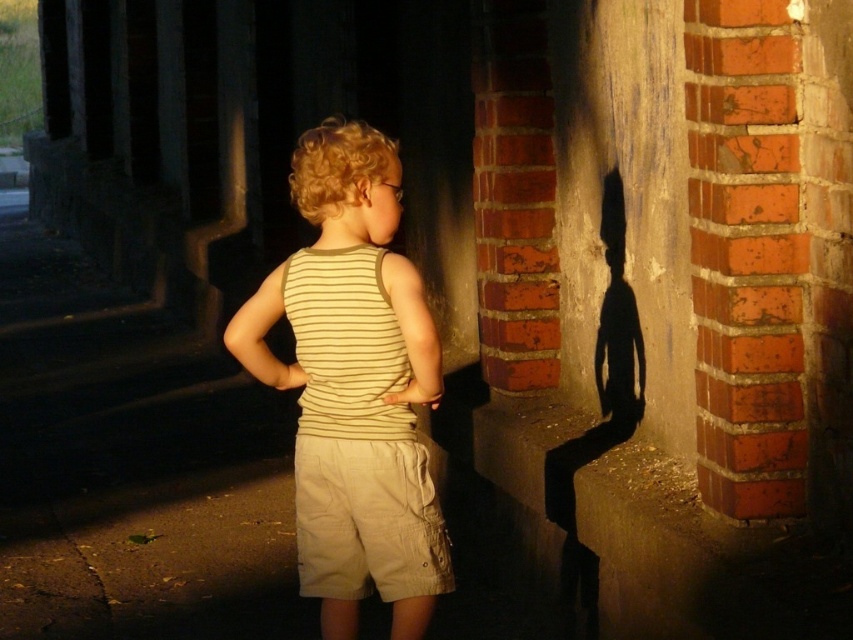
Who is taller, striped cotton tank top at center or khaki cotton shorts at center?

striped cotton tank top at center is taller.

This screenshot has height=640, width=853. Describe the element at coordinates (354, 385) in the screenshot. I see `striped cotton tank top at center` at that location.

The width and height of the screenshot is (853, 640). In order to click on striped cotton tank top at center in this screenshot , I will do `click(354, 385)`.